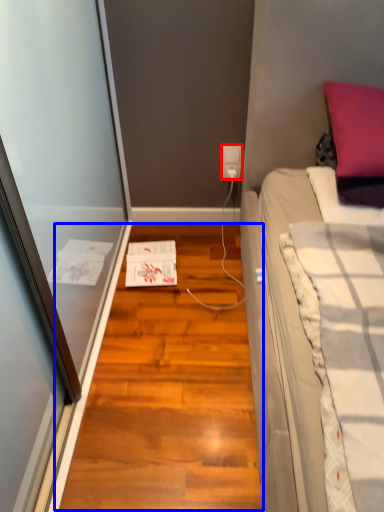
Question: Among these objects, which one is nearest to the camera, power outlet (highlighted by a red box) or hardwood (highlighted by a blue box)?

Choices:
 (A) power outlet
 (B) hardwood

Answer: (B)